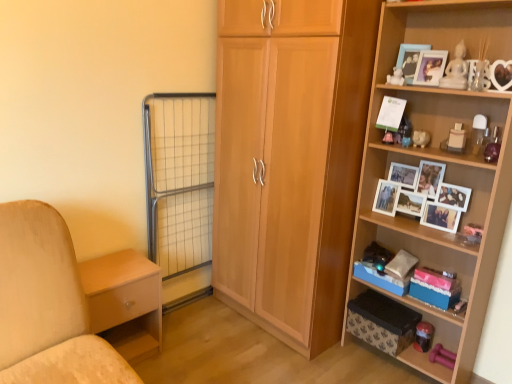
This screenshot has width=512, height=384. Identify the location of free spot in front of light brown wood cupboard at center. (273, 362).